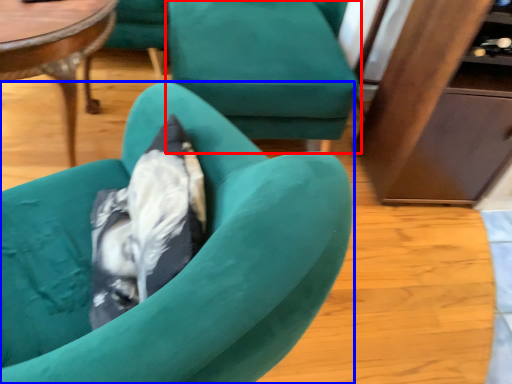
Question: Which point is further to the camera, chair (highlighted by a red box) or chair (highlighted by a blue box)?

Choices:
 (A) chair
 (B) chair

Answer: (A)